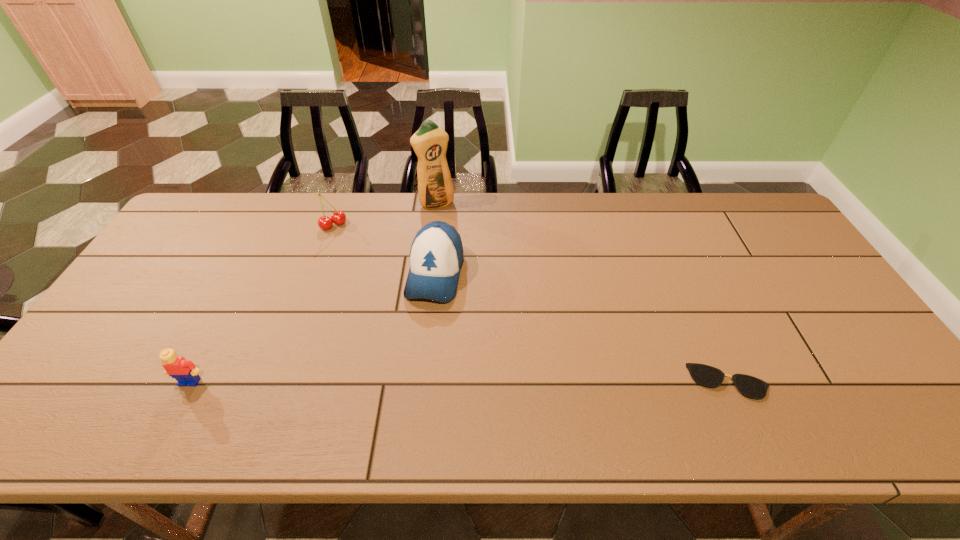
Locate an element on the screen. The image size is (960, 540). empty space that is in between the baseball cap and the spectacles is located at coordinates (582, 328).

At what (x,y) coordinates should I click in order to perform the action: click on unoccupied position between the leftmost object and the farthest object. Please return your answer as a coordinate pair (x, y). The width and height of the screenshot is (960, 540). Looking at the image, I should click on (313, 293).

Locate an element on the screen. This screenshot has height=540, width=960. vacant region between the third farthest object and the Lego is located at coordinates (313, 328).

This screenshot has width=960, height=540. I want to click on vacant point located between the shortest object and the tallest object, so click(583, 293).

Locate an element on the screen. The image size is (960, 540). vacant area between the cherry and the leftmost object is located at coordinates (262, 303).

I want to click on blank region between the Lego and the fourth object from right to left, so click(262, 303).

Find the location of a particular element. The height and width of the screenshot is (540, 960). object that is the second closest to the leftmost object is located at coordinates (338, 217).

Find the location of a particular element. the third closest object to the leftmost object is located at coordinates 435,188.

The height and width of the screenshot is (540, 960). What are the coordinates of `free location that satisfies the following two spatial constraints: 1. on the face of the Lego; 2. on the left side of the rightmost object` in the screenshot? It's located at (190, 382).

This screenshot has height=540, width=960. What are the coordinates of `free point that satisfies the following two spatial constraints: 1. on the face of the Lego; 2. on the right side of the rightmost object` in the screenshot? It's located at (190, 382).